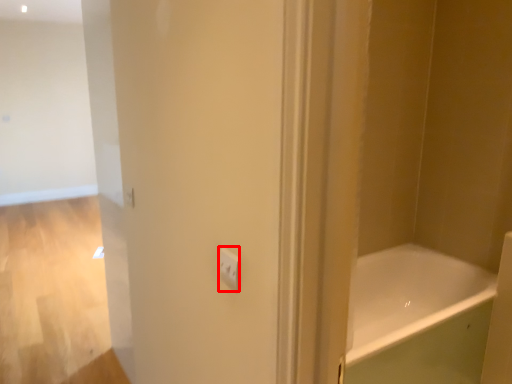
Question: From the image's perspective, considering the relative positions of light switch (annotated by the red box) and bathtub in the image provided, where is light switch (annotated by the red box) located with respect to the staircase?

Choices:
 (A) below
 (B) above

Answer: (B)